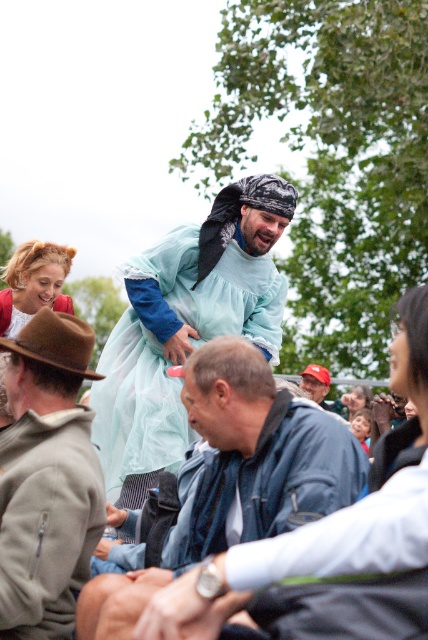
You are a costume designer preparing for a play and need to choose between the denim jacket at center and the red cap at center for a character. Based on their sizes, which one would you recommend as more suitable for a larger, more noticeable costume piece?

The denim jacket at center has a larger size compared to the red cap at center, so it would be more suitable for a larger, more noticeable costume piece.